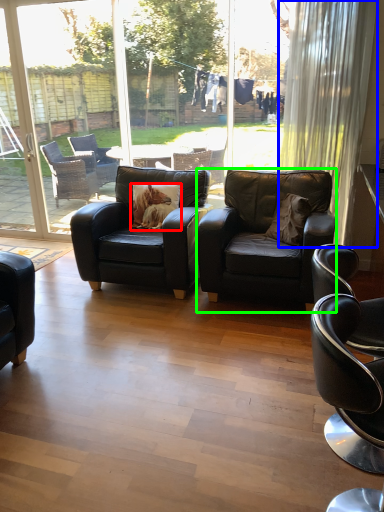
Question: Which object is the closest to the pillow (highlighted by a red box)? Choose among these: curtain (highlighted by a blue box) or chair (highlighted by a green box).

Choices:
 (A) curtain
 (B) chair

Answer: (B)